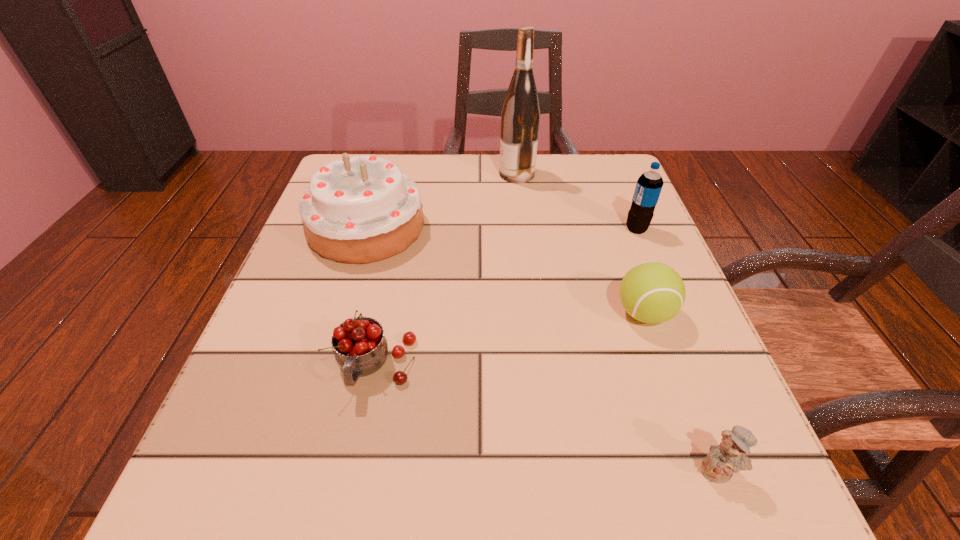
This screenshot has width=960, height=540. Identify the location of vacant space situated 0.110m on the handle side of the cherry. (353, 478).

Find the location of a particular element. The height and width of the screenshot is (540, 960). vacant position located 0.050m on the back of the tennis ball is located at coordinates (630, 273).

Find the location of a particular element. The height and width of the screenshot is (540, 960). wine bottle that is at the far edge is located at coordinates point(520,117).

Identify the location of cake present at the far edge. The height and width of the screenshot is (540, 960). (362, 209).

Identify the location of object that is at the near edge. (729, 456).

The image size is (960, 540). Find the location of `cake present at the left edge`. cake present at the left edge is located at coordinates (362, 209).

Identify the location of cherry present at the left edge. (360, 347).

Find the location of a particular element. This screenshot has width=960, height=540. soda bottle that is at the right edge is located at coordinates (649, 185).

You are a GUI agent. You are given a task and a screenshot of the screen. Output one action in this format:
    pyautogui.click(x=<x>, y=<y>)
    Task: Click on the tennis ball located at the right edge
    
    Given the screenshot: What is the action you would take?
    pyautogui.click(x=651, y=292)

In order to click on teddy bear present at the right edge in this screenshot , I will do `click(729, 456)`.